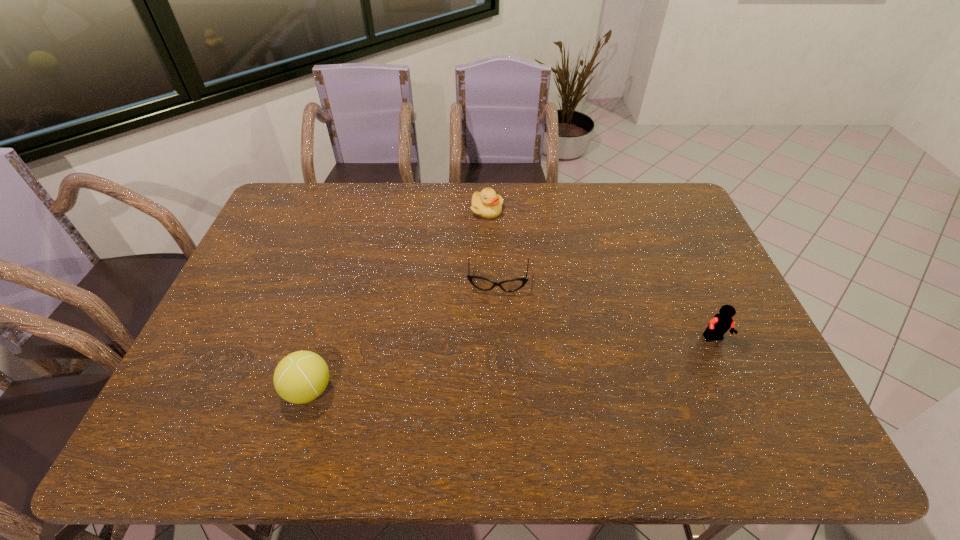
Identify the location of empty location between the tennis ball and the second nearest object. The height and width of the screenshot is (540, 960). (512, 364).

Where is `empty space that is in between the third farthest object and the leftmost object`? empty space that is in between the third farthest object and the leftmost object is located at coordinates (512, 364).

Where is `vacant area between the nearest object and the Lego`? The image size is (960, 540). vacant area between the nearest object and the Lego is located at coordinates (512, 364).

Locate an element on the screen. The image size is (960, 540). vacant area that lies between the third nearest object and the leftmost object is located at coordinates (403, 336).

Point out which object is positioned as the nearest to the spectacles. Please provide its 2D coordinates. Your answer should be formatted as a tuple, i.e. [(x, y)], where the tuple contains the x and y coordinates of a point satisfying the conditions above.

[(487, 204)]

You are a GUI agent. You are given a task and a screenshot of the screen. Output one action in this format:
    pyautogui.click(x=<x>, y=<y>)
    Task: Click on the object that stands as the third closest to the second farthest object
    This screenshot has height=540, width=960.
    Given the screenshot: What is the action you would take?
    pyautogui.click(x=720, y=323)

You are a GUI agent. You are given a task and a screenshot of the screen. Output one action in this format:
    pyautogui.click(x=<x>, y=<y>)
    Task: Click on the free spot that satisfies the following two spatial constraints: 1. on the back side of the third tallest object; 2. on the left side of the tennis ball
    The width and height of the screenshot is (960, 540).
    Given the screenshot: What is the action you would take?
    pyautogui.click(x=363, y=211)

Where is `vacant space that satisfies the following two spatial constraints: 1. on the front side of the spectacles; 2. on the left side of the farthest object`? The height and width of the screenshot is (540, 960). vacant space that satisfies the following two spatial constraints: 1. on the front side of the spectacles; 2. on the left side of the farthest object is located at coordinates (488, 281).